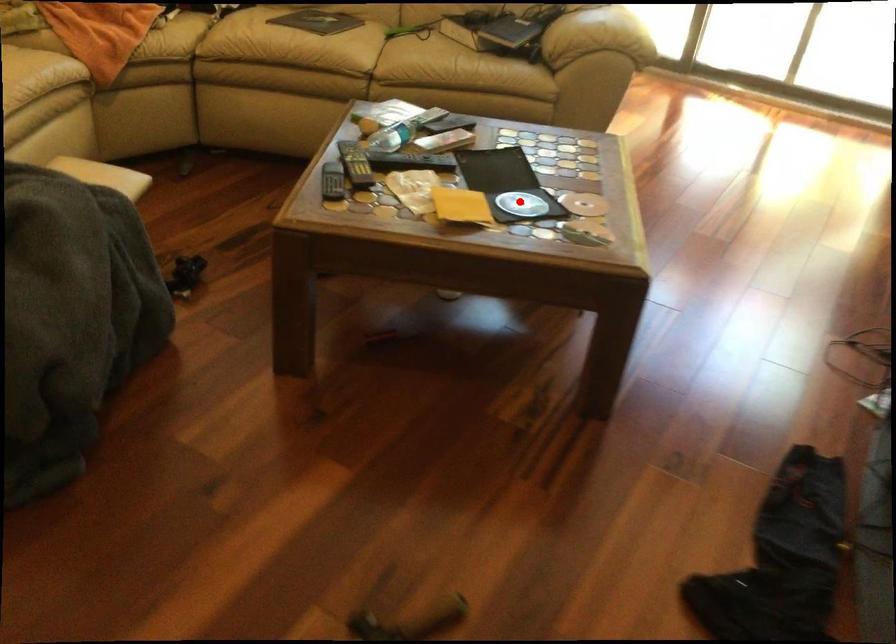
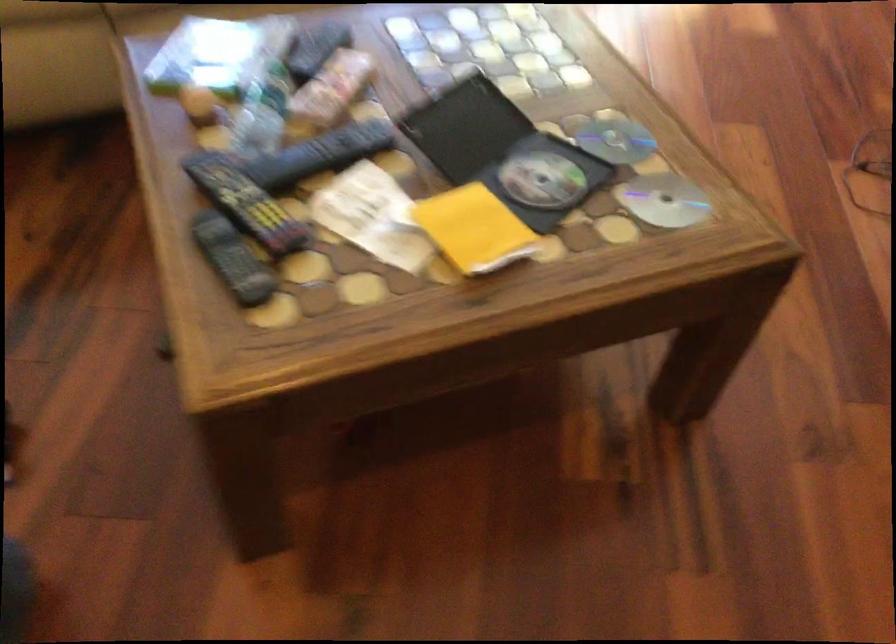
Question: I am providing you with two images of the same scene from different viewpoints. In image1, a red point is highlighted. Considering the same 3D point in image2, which of the following is correct?

Choices:
 (A) It is closer
 (B) It is farther

Answer: (A)